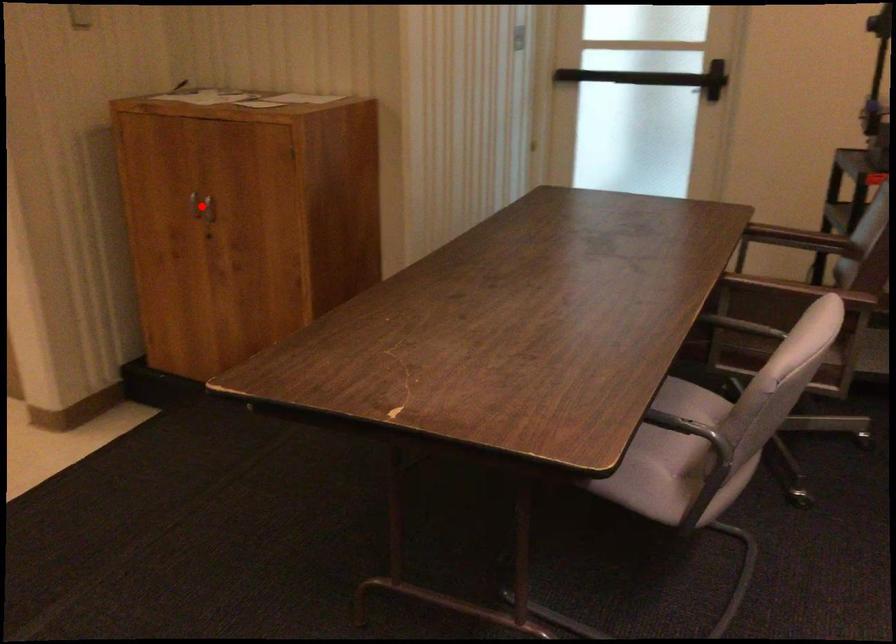
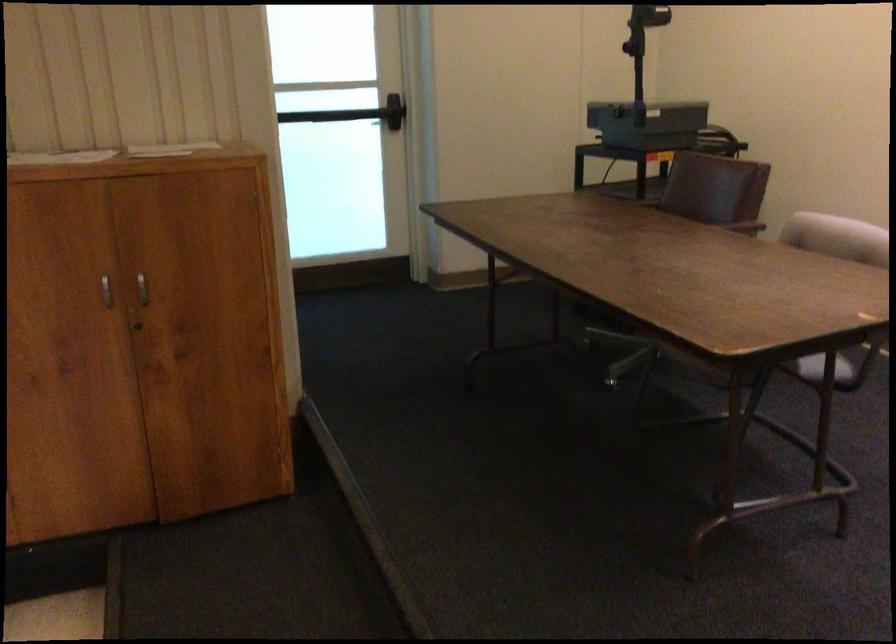
Question: I am providing you with two images of the same scene from different viewpoints. Given a red point in image1, look at the same physical point in image2. Is it:

Choices:
 (A) Closer to the viewpoint
 (B) Farther from the viewpoint

Answer: (A)